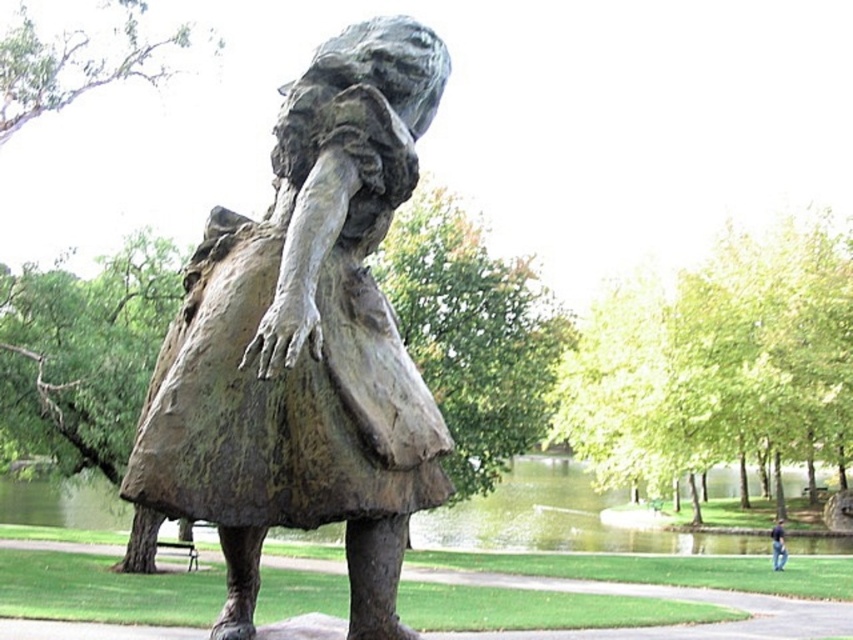
You are an artist planning to sketch the scene. You need to decide which object to focus on first based on their sizes. Which one should you sketch first, the bronze statue at center or the dark blue jeans at lower right?

The bronze statue at center occupies less space than the dark blue jeans at lower right, so you should sketch the bronze statue at center first since it is smaller and can be outlined quickly before moving on to the larger dark blue jeans at lower right.

You are an artist planning to sketch the scene in front of you. You notice the bronze statue at center and the dark blue jeans at lower right. Which object should you draw first if you want to capture the wider object first?

The dark blue jeans at lower right should be drawn first because it has a greater width than the bronze statue at center according to the description.

You are a park visitor who wants to take a photo of the bronze statue at center and the dark blue jeans at lower right together in the frame. Based on their heights, which object should you position closer to the camera to ensure both are fully visible in the photo?

The bronze statue at center is shorter than dark blue jeans at lower right. To ensure both are fully visible in the photo, position the bronze statue at center closer to the camera so its smaller size can be better captured alongside the taller dark blue jeans at lower right.